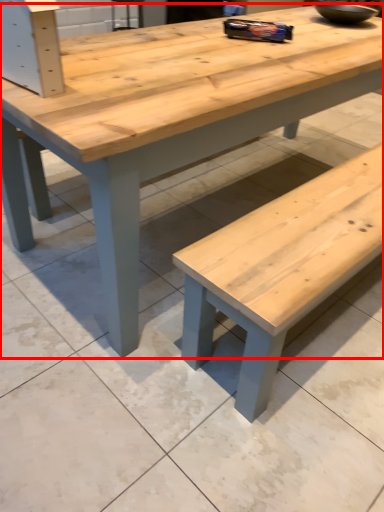
Question: Considering the relative positions of table (annotated by the red box) and bowl in the image provided, where is table (annotated by the red box) located with respect to the staircase?

Choices:
 (A) left
 (B) right

Answer: (A)